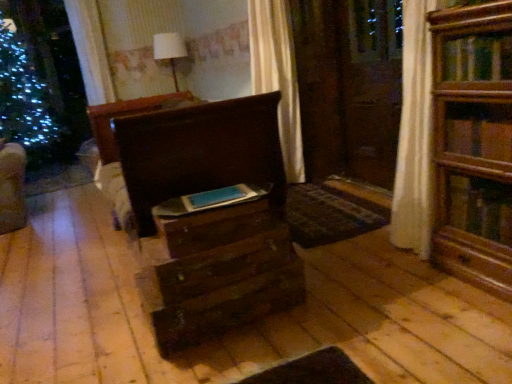
Question: Are matte blue book at center and dark wood chest of drawers at center located far from each other?

Choices:
 (A) yes
 (B) no

Answer: (B)

Question: From a real-world perspective, is matte blue book at center under dark wood chest of drawers at center?

Choices:
 (A) yes
 (B) no

Answer: (B)

Question: Does matte blue book at center have a larger size compared to dark wood chest of drawers at center?

Choices:
 (A) no
 (B) yes

Answer: (A)

Question: Is matte blue book at center oriented away from dark wood chest of drawers at center?

Choices:
 (A) no
 (B) yes

Answer: (A)

Question: Does matte blue book at center appear on the left side of dark wood chest of drawers at center?

Choices:
 (A) yes
 (B) no

Answer: (B)

Question: Is matte blue book at center not inside dark wood chest of drawers at center?

Choices:
 (A) no
 (B) yes

Answer: (B)

Question: Does dark wood chest of drawers at center have a smaller size compared to matte blue book at center?

Choices:
 (A) yes
 (B) no

Answer: (B)

Question: Is dark wood chest of drawers at center behind matte blue book at center?

Choices:
 (A) yes
 (B) no

Answer: (B)

Question: Could you tell me if dark wood chest of drawers at center is facing matte blue book at center?

Choices:
 (A) yes
 (B) no

Answer: (B)

Question: Is dark wood chest of drawers at center at the left side of matte blue book at center?

Choices:
 (A) yes
 (B) no

Answer: (A)

Question: From a real-world perspective, is dark wood chest of drawers at center located higher than matte blue book at center?

Choices:
 (A) yes
 (B) no

Answer: (B)

Question: Can you confirm if dark wood chest of drawers at center is shorter than matte blue book at center?

Choices:
 (A) no
 (B) yes

Answer: (A)

Question: Is wooden drawer at center, which is counted as the second drawer, starting from the bottom, far from dark wood chest of drawers at center?

Choices:
 (A) no
 (B) yes

Answer: (A)